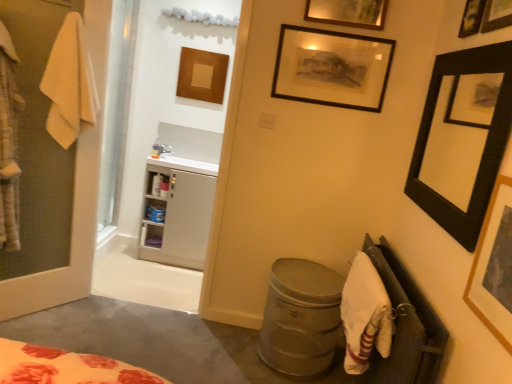
Question: Is white cotton bath towel at lower right, which ranks as the second bath towel in left-to-right order, looking in the opposite direction of white fabric at lower right?

Choices:
 (A) no
 (B) yes

Answer: (B)

Question: From the image's perspective, is white cotton bath towel at lower right, which ranks as the second bath towel in left-to-right order, on white fabric at lower right?

Choices:
 (A) no
 (B) yes

Answer: (B)

Question: Does white cotton bath towel at lower right, which ranks as the second bath towel in left-to-right order, have a lesser width compared to white fabric at lower right?

Choices:
 (A) no
 (B) yes

Answer: (A)

Question: Does white cotton bath towel at lower right, the first bath towel from the bottom, have a smaller size compared to white fabric at lower right?

Choices:
 (A) yes
 (B) no

Answer: (A)

Question: Can you confirm if white cotton bath towel at lower right, the first bath towel from the bottom, is shorter than white fabric at lower right?

Choices:
 (A) no
 (B) yes

Answer: (B)

Question: Considering the relative sizes of white cotton bath towel at lower right, the first bath towel from the bottom, and white fabric at lower right in the image provided, is white cotton bath towel at lower right, the first bath towel from the bottom, wider than white fabric at lower right?

Choices:
 (A) no
 (B) yes

Answer: (B)

Question: Can you confirm if wooden framed artwork at upper right, the third picture frame when ordered from right to left, is positioned to the right of wooden framed picture at upper right, which is the second picture frame in front-to-back order?

Choices:
 (A) yes
 (B) no

Answer: (B)

Question: Is the depth of wooden framed artwork at upper right, acting as the first picture frame starting from the front, greater than that of wooden framed picture at upper right, which is the second picture frame in front-to-back order?

Choices:
 (A) no
 (B) yes

Answer: (A)

Question: Is wooden framed artwork at upper right, acting as the first picture frame starting from the front, taller than wooden framed picture at upper right, which is the second picture frame in front-to-back order?

Choices:
 (A) no
 (B) yes

Answer: (B)

Question: From a real-world perspective, is wooden framed artwork at upper right, the third picture frame from the left, beneath wooden framed picture at upper right, the fifth picture frame positioned from the left?

Choices:
 (A) yes
 (B) no

Answer: (A)

Question: Could wooden framed picture at upper right, positioned as the first picture frame in right-to-left order, be considered to be inside wooden framed artwork at upper right, positioned as the 5th picture frame in back-to-front order?

Choices:
 (A) yes
 (B) no

Answer: (B)

Question: Does wooden framed artwork at upper right, acting as the first picture frame starting from the front, have a lesser width compared to wooden framed picture at upper right, which is the second picture frame in front-to-back order?

Choices:
 (A) yes
 (B) no

Answer: (B)

Question: Considering the relative sizes of white glossy sink at upper left and white fabric at lower right in the image provided, is white glossy sink at upper left shorter than white fabric at lower right?

Choices:
 (A) no
 (B) yes

Answer: (B)